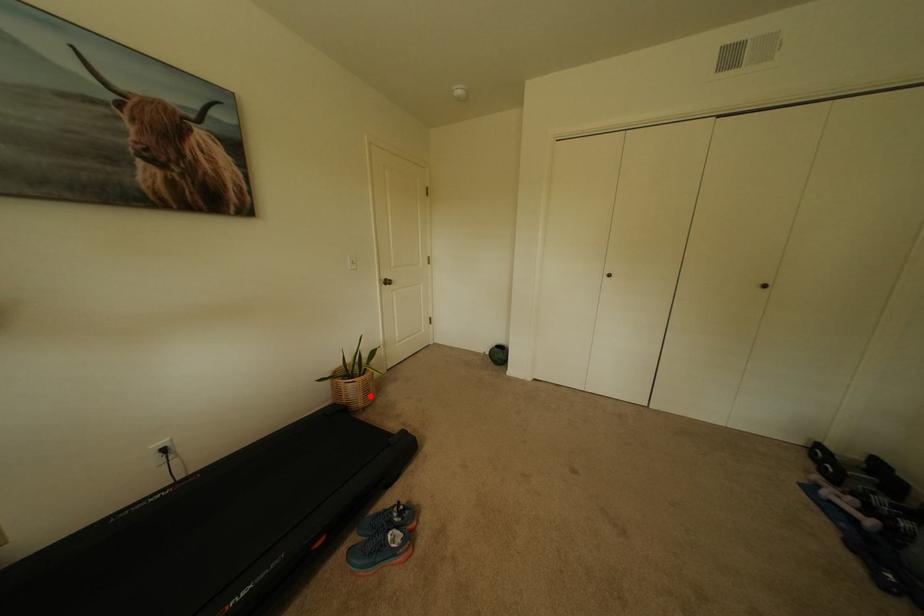
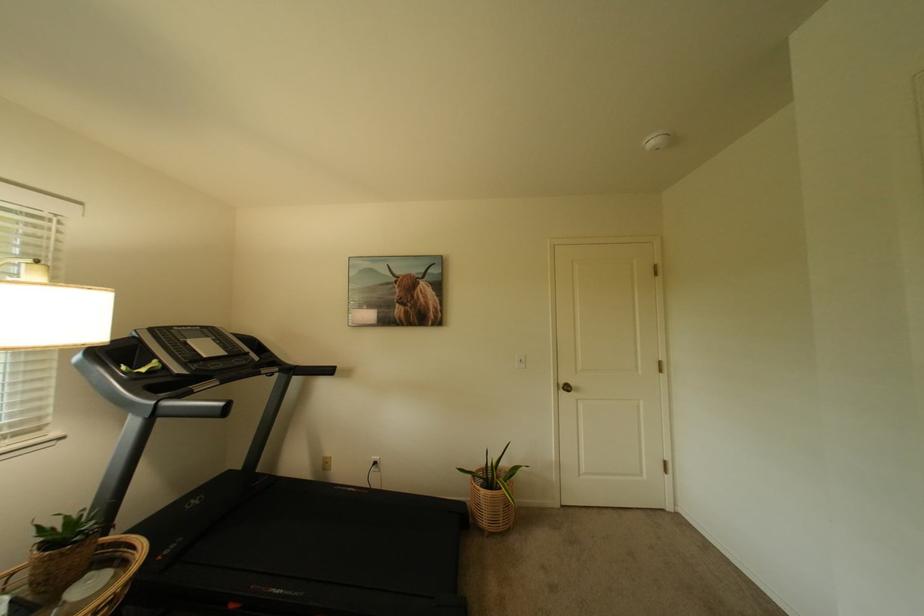
In the second image, find the point that corresponds to the highlighted location in the first image.

(495, 515)